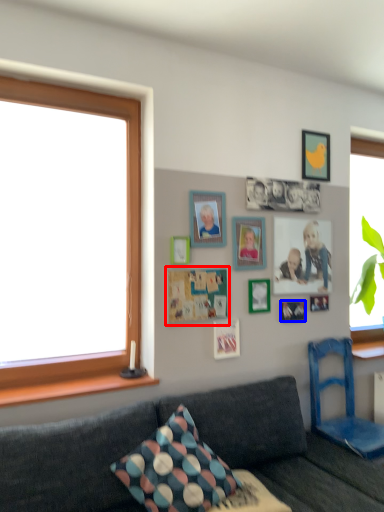
Question: Which of the following is the closest to the observer, bulletin board (highlighted by a red box) or decorative picture (highlighted by a blue box)?

Choices:
 (A) bulletin board
 (B) decorative picture

Answer: (A)